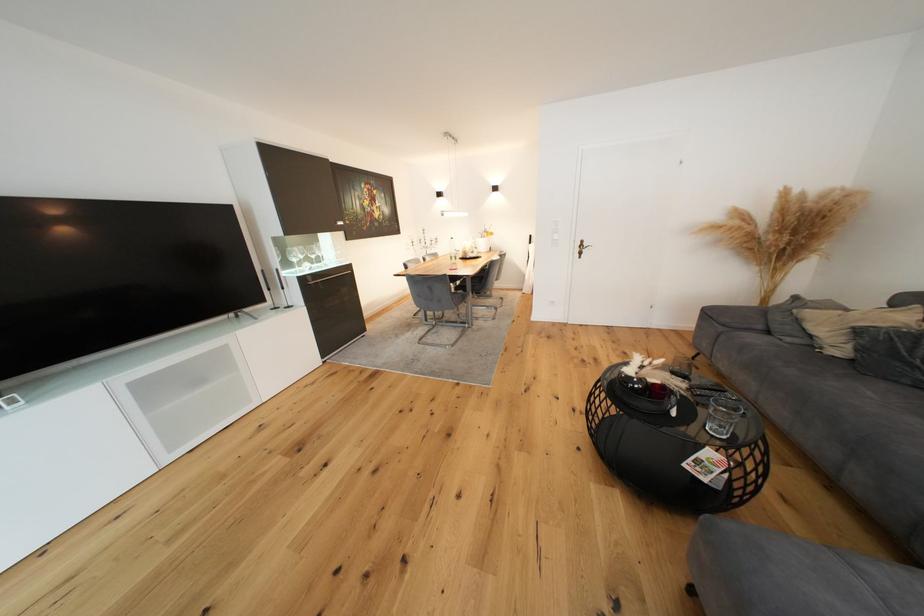
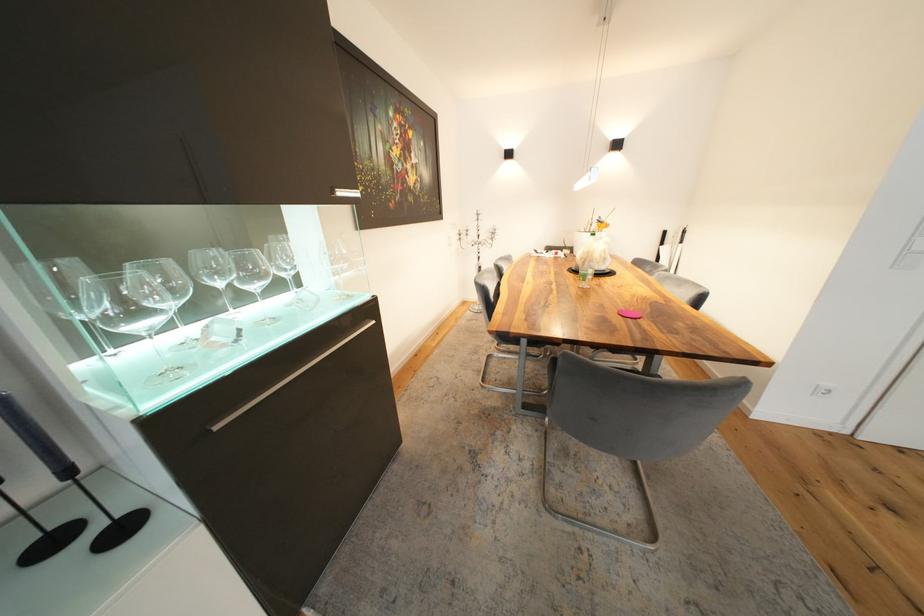
Find the pixel in the second image that matches point (347, 225) in the first image.

(348, 195)